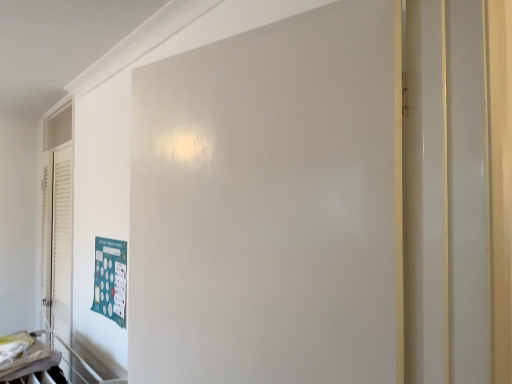
This screenshot has height=384, width=512. What do you see at coordinates (271, 205) in the screenshot?
I see `white matte door at center` at bounding box center [271, 205].

At what (x,y) coordinates should I click in order to perform the action: click on white matte door at center. Please return your answer as a coordinate pair (x, y). This screenshot has height=384, width=512. Looking at the image, I should click on (271, 205).

Find the location of a particular element. The width and height of the screenshot is (512, 384). teal matte poster at lower left is located at coordinates (110, 279).

Describe the element at coordinates (110, 279) in the screenshot. I see `teal matte poster at lower left` at that location.

Find the location of `white matte door at center`. white matte door at center is located at coordinates (271, 205).

Considering the relative positions of teal matte poster at lower left and white matte door at center in the image provided, is teal matte poster at lower left to the left of white matte door at center from the viewer's perspective?

Yes.

Which is in front, teal matte poster at lower left or white matte door at center?

white matte door at center.

Which point is more distant from viewer, (120, 247) or (387, 324)?

Point (120, 247)

From the image's perspective, is teal matte poster at lower left positioned above or below white matte door at center?

teal matte poster at lower left is below white matte door at center.

From a real-world perspective, is teal matte poster at lower left below white matte door at center?

Correct, in the physical world, teal matte poster at lower left is lower than white matte door at center.

From the picture: Considering the sizes of objects teal matte poster at lower left and white matte door at center in the image provided, who is wider, teal matte poster at lower left or white matte door at center?

white matte door at center.

In terms of height, does teal matte poster at lower left look taller or shorter compared to white matte door at center?

teal matte poster at lower left is shorter than white matte door at center.

Looking at this image, looking at the image, does teal matte poster at lower left seem bigger or smaller compared to white matte door at center?

In the image, teal matte poster at lower left appears to be smaller than white matte door at center.

Is teal matte poster at lower left surrounding white matte door at center?

No, teal matte poster at lower left does not contain white matte door at center.

Consider the image. Is teal matte poster at lower left with white matte door at center?

teal matte poster at lower left and white matte door at center are clearly separated.

Is teal matte poster at lower left positioned with its back to white matte door at center?

teal matte poster at lower left does not have its back to white matte door at center.

There is a teal matte poster at lower left. At what (x,y) coordinates should I click in order to perform the action: click on door above it (from a real-world perspective). Please return your answer as a coordinate pair (x, y). The image size is (512, 384). Looking at the image, I should click on (271, 205).

Considering the relative positions of white matte door at center and teal matte poster at lower left in the image provided, is white matte door at center to the left of teal matte poster at lower left from the viewer's perspective?

No.

From the picture: Relative to teal matte poster at lower left, is white matte door at center in front or behind?

white matte door at center is in front of teal matte poster at lower left.

Which is behind, point (170, 273) or point (112, 258)?

The point (112, 258) is farther from the camera.

Consider the image. From the image's perspective, between white matte door at center and teal matte poster at lower left, which one is located above?

white matte door at center.

From a real-world perspective, relative to teal matte poster at lower left, is white matte door at center vertically above or below?

white matte door at center is situated higher than teal matte poster at lower left in the real world.

Can you confirm if white matte door at center is wider than teal matte poster at lower left?

Yes.

Who is taller, white matte door at center or teal matte poster at lower left?

Standing taller between the two is white matte door at center.

Does white matte door at center have a larger size compared to teal matte poster at lower left?

Indeed, white matte door at center has a larger size compared to teal matte poster at lower left.

Is white matte door at center situated inside teal matte poster at lower left or outside?

white matte door at center is outside teal matte poster at lower left.

Are white matte door at center and teal matte poster at lower left beside each other?

white matte door at center is not next to teal matte poster at lower left, and they're not touching.

Is white matte door at center turned away from teal matte poster at lower left?

That's not correct — white matte door at center is not looking away from teal matte poster at lower left.

How distant is white matte door at center from teal matte poster at lower left?

white matte door at center is 1.11 meters from teal matte poster at lower left.

The height and width of the screenshot is (384, 512). In order to click on door positioned vertically above the teal matte poster at lower left (from a real-world perspective) in this screenshot , I will do `click(271, 205)`.

This screenshot has width=512, height=384. I want to click on door on the right side of teal matte poster at lower left, so (271, 205).

At what (x,y) coordinates should I click in order to perform the action: click on poster directly beneath the white matte door at center (from a real-world perspective). Please return your answer as a coordinate pair (x, y). The height and width of the screenshot is (384, 512). Looking at the image, I should click on (110, 279).